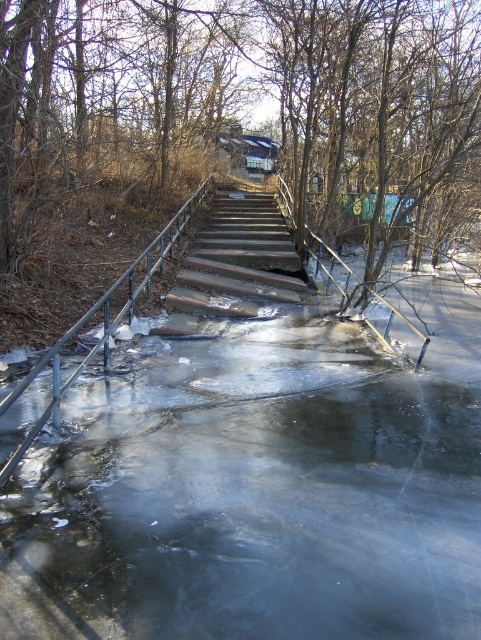
Does point (188, 432) lie in front of point (270, 204)?

Yes, it is.

Is point (142, 269) positioned after point (188, 307)?

Yes, point (142, 269) is behind point (188, 307).

Identify the location of transparent ice at center. The height and width of the screenshot is (640, 481). (x=242, y=464).

Is concrete steps at center above metal/rusty rail at left?

Yes, concrete steps at center is above metal/rusty rail at left.

Looking at this image, does concrete steps at center have a smaller size compared to metal/rusty rail at left?

Correct, concrete steps at center occupies less space than metal/rusty rail at left.

Does point (254, 275) come in front of point (166, 227)?

That is False.

You are a GUI agent. You are given a task and a screenshot of the screen. Output one action in this format:
    pyautogui.click(x=<x>, y=<y>)
    Task: Click on the concrete steps at center
    
    Given the screenshot: What is the action you would take?
    pyautogui.click(x=240, y=260)

Is transparent ice at center shorter than metal/rusty rail at left?

Yes.

Who is more distant from viewer, [467,548] or [146,285]?

The point [146,285] is behind.

You are a GUI agent. You are given a task and a screenshot of the screen. Output one action in this format:
    pyautogui.click(x=<x>, y=<y>)
    Task: Click on the transparent ice at center
    The height and width of the screenshot is (640, 481).
    Given the screenshot: What is the action you would take?
    pyautogui.click(x=242, y=464)